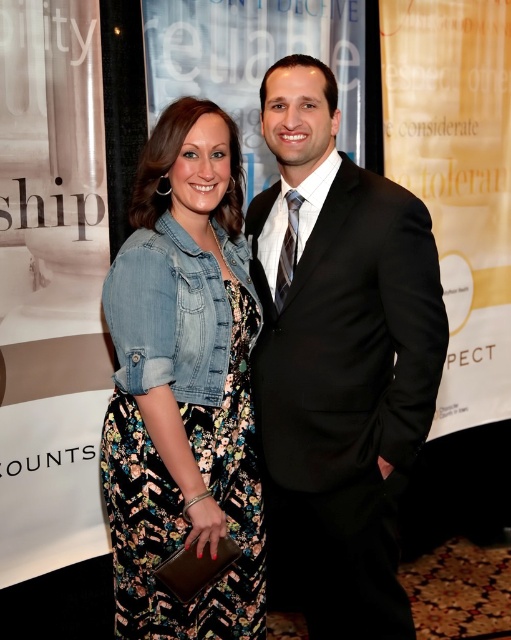
Is black satin suit at center positioned behind denim jacket at center?

Yes, black satin suit at center is further from the viewer.

The height and width of the screenshot is (640, 511). What do you see at coordinates (339, 355) in the screenshot?
I see `black satin suit at center` at bounding box center [339, 355].

Which is behind, point (336, 484) or point (250, 586)?

Positioned behind is point (250, 586).

Where is `black satin suit at center`? black satin suit at center is located at coordinates (339, 355).